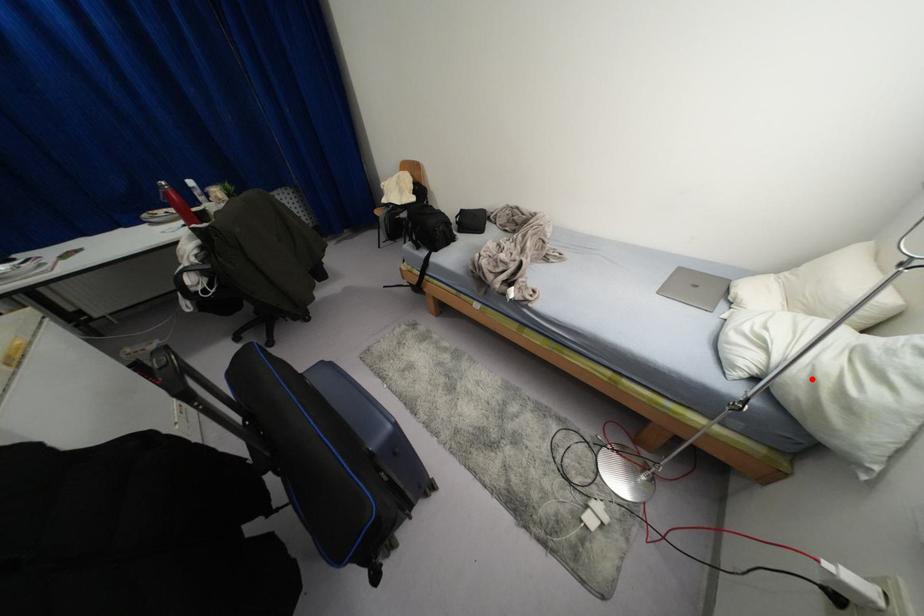
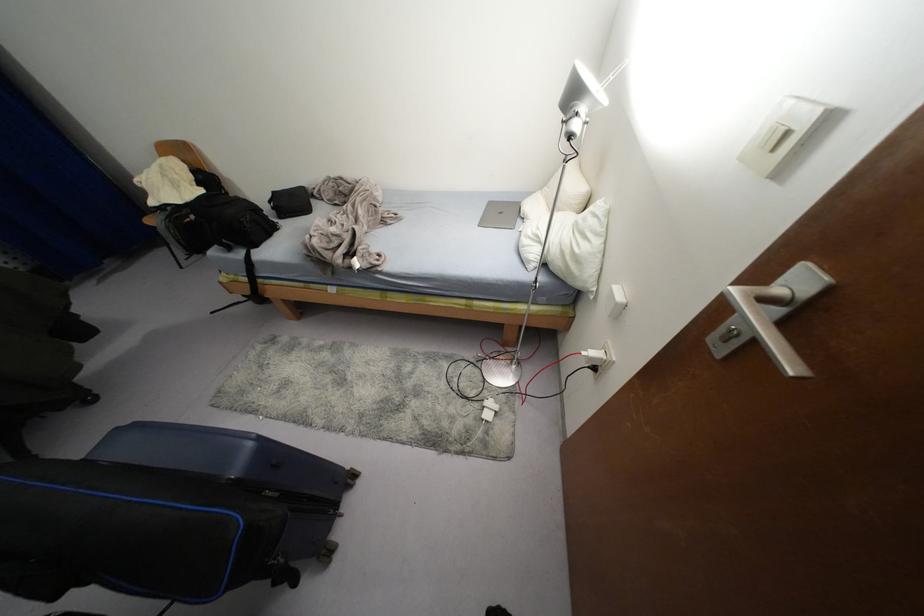
Locate, in the second image, the point that corresponds to the highlighted location in the first image.

(561, 251)